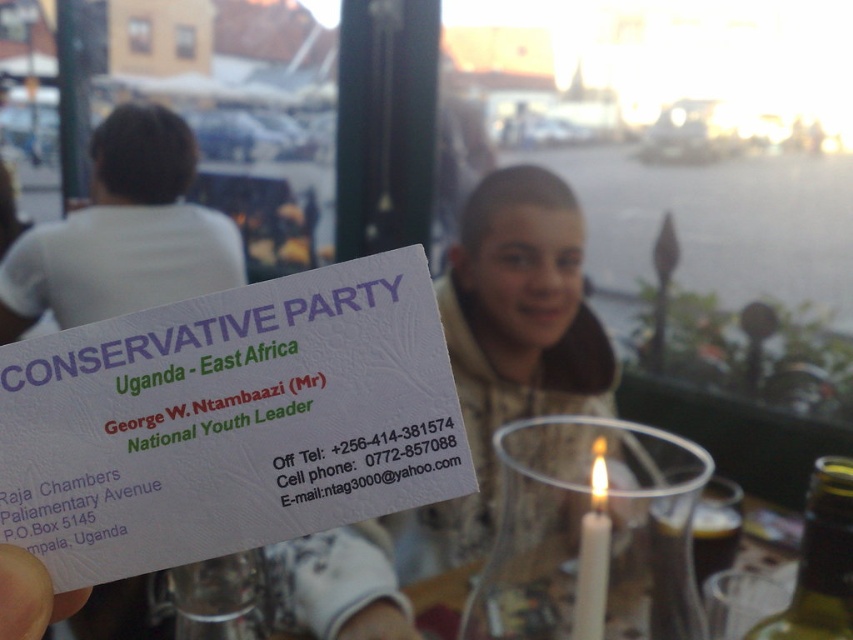
You are a graphic designer asked to create a new layout for the white textured business card at center and the translucent glass candle at center. Since the card needs to be placed next to the candle on a table, which object should be positioned to the left to ensure they are aligned properly based on their widths?

The white textured business card at center has a lesser width compared to the translucent glass candle at center, so to align them properly, the white textured business card at center should be placed to the left of the translucent glass candle at center since it is narrower.

You are organizing a small event and need to place both the white textured business card at center and the translucent glass candle at center on a table. If you want to arrange them so that the smaller item is placed to the left of the larger one, which object should be on the left?

The white textured business card at center is smaller than the translucent glass candle at center, so the white textured business card at center should be placed to the left of the translucent glass candle at center.